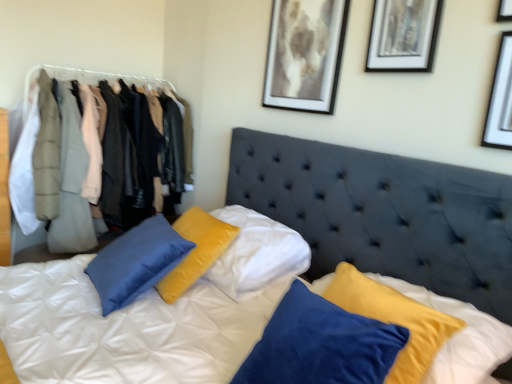
Question: Considering their positions, is velvet jackets at left located in front of or behind white matte picture frame at upper right, the first picture frame viewed from the right?

Choices:
 (A) behind
 (B) front

Answer: (A)

Question: From the image's perspective, is velvet jackets at left located above or below white matte picture frame at upper right, which is counted as the 3th picture frame, starting from the left?

Choices:
 (A) below
 (B) above

Answer: (A)

Question: Which is farther from the matte black picture frame at upper right, the 2th picture frame when ordered from left to right?

Choices:
 (A) white matte picture frame at upper right, marked as the third picture frame in a back-to-front arrangement
 (B) velvet jackets at left
 (C) matte gray coat at left, placed as the second clothing when sorted from front to back
 (D) suede-like dark blue headboard at center
 (E) matte black picture frame at upper center, placed as the first picture frame when sorted from back to front

Answer: (C)

Question: Which object is the farthest from the light beige fabric coat at left, marked as the 1th clothing in a front-to-back arrangement?

Choices:
 (A) suede-like dark blue headboard at center
 (B) white matte picture frame at upper right, the first picture frame viewed from the right
 (C) matte black picture frame at upper center, marked as the 3th picture frame in a right-to-left arrangement
 (D) velvet jackets at left
 (E) matte gray coat at left, which ranks as the first clothing in back-to-front order

Answer: (B)